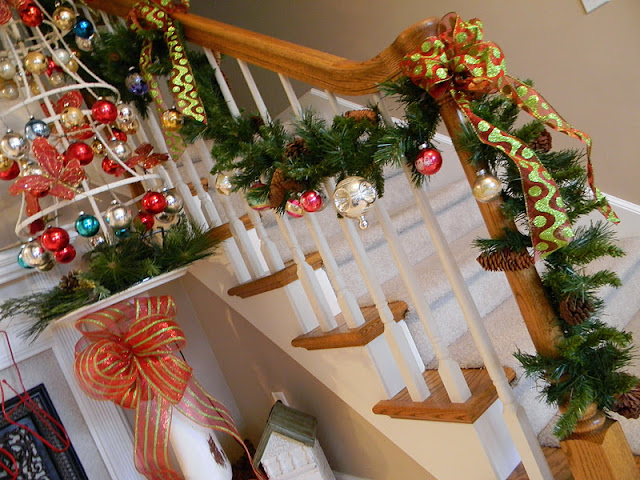
Where is `plant`? This screenshot has width=640, height=480. plant is located at coordinates (137, 249).